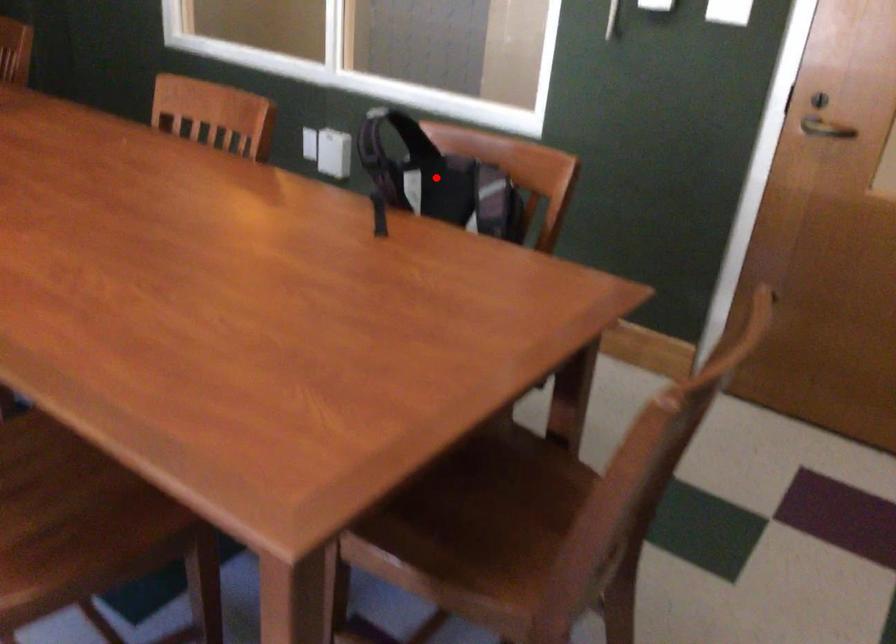
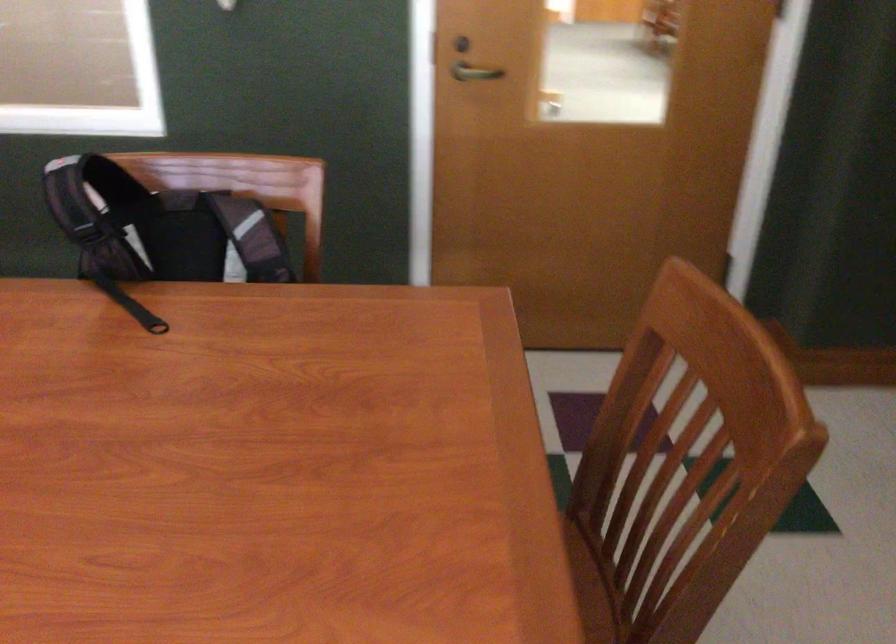
In the second image, find the point that corresponds to the highlighted location in the first image.

(159, 228)